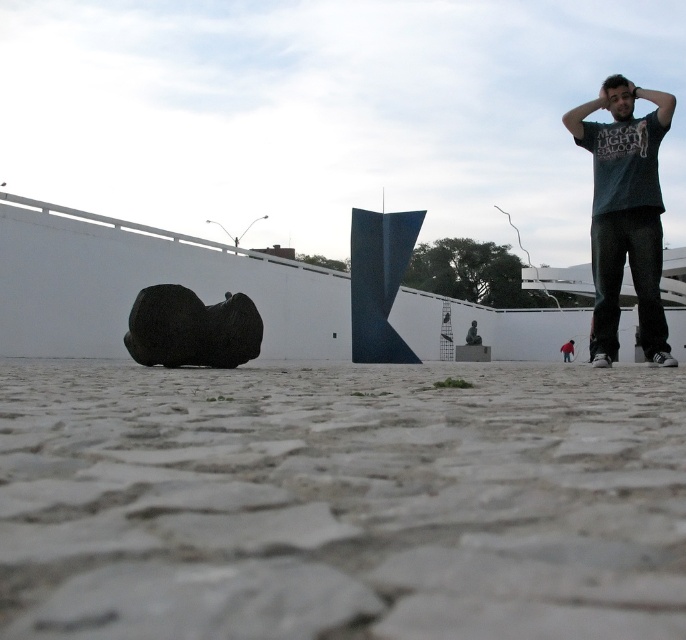
Which is more to the right, cobblestone pavement at lower center or dark green t-shirt at right?

dark green t-shirt at right

This screenshot has width=686, height=640. Describe the element at coordinates (340, 500) in the screenshot. I see `cobblestone pavement at lower center` at that location.

In order to click on cobblestone pavement at lower center in this screenshot , I will do `click(340, 500)`.

Does cobblestone pavement at lower center have a lesser height compared to black matte sculpture at lower left?

Correct, cobblestone pavement at lower center is not as tall as black matte sculpture at lower left.

Does cobblestone pavement at lower center have a larger size compared to black matte sculpture at lower left?

Indeed, cobblestone pavement at lower center has a larger size compared to black matte sculpture at lower left.

Does point (362, 497) come closer to viewer compared to point (209, 323)?

Yes, it is.

Identify the location of cobblestone pavement at lower center. pyautogui.click(x=340, y=500).

Which is more to the right, dark green t-shirt at right or black matte sculpture at lower left?

Positioned to the right is dark green t-shirt at right.

At what (x,y) coordinates should I click in order to perform the action: click on dark green t-shirt at right. Please return your answer as a coordinate pair (x, y). Looking at the image, I should click on (626, 212).

Where is `dark green t-shirt at right`? dark green t-shirt at right is located at coordinates (626, 212).